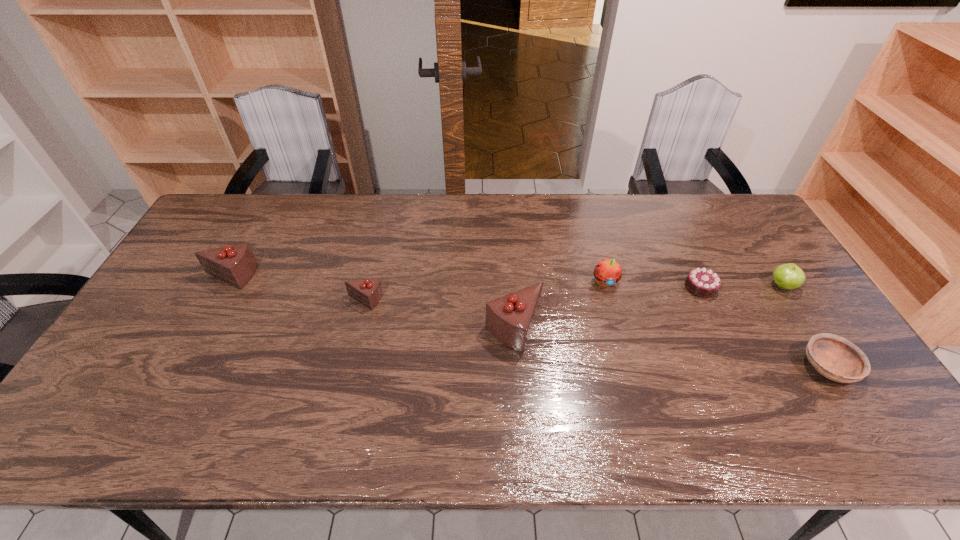
Find the location of a particular element. apple that is at the right edge is located at coordinates (789, 276).

This screenshot has width=960, height=540. I want to click on object located at the near right corner, so click(x=836, y=358).

In the image, there is a desktop. Identify the location of vacant space at the far edge. (369, 217).

This screenshot has width=960, height=540. In the image, there is a desktop. Identify the location of vacant space at the near edge. (780, 386).

The height and width of the screenshot is (540, 960). Identify the location of free space at the right edge of the desktop. (762, 278).

In the image, there is a desktop. Where is `vacant space at the far right corner`? The image size is (960, 540). vacant space at the far right corner is located at coordinates (722, 197).

Where is `free space at the near right corner`? free space at the near right corner is located at coordinates (837, 384).

Identify the location of vacant space in between the left apple and the bowl. (716, 324).

The image size is (960, 540). I want to click on free space between the second chocolate cake from right to left and the right apple, so click(648, 307).

The width and height of the screenshot is (960, 540). In order to click on vacant region between the second object from left to right and the right apple in this screenshot , I will do `click(573, 293)`.